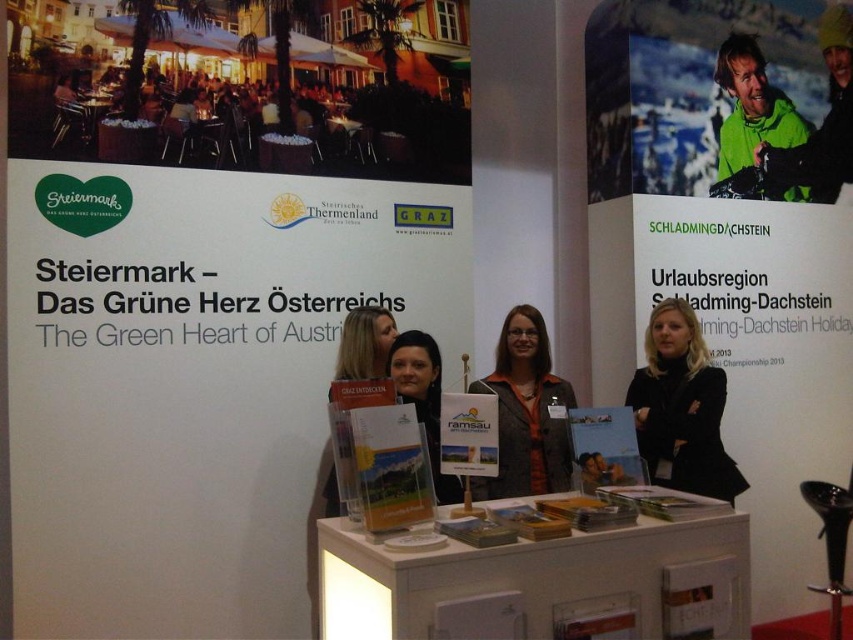
Question: Based on their relative distances, which object is farther from the matte black hair at center?

Choices:
 (A) black glossy poster at right
 (B) white glossy table at center
 (C) matte black jacket at center
 (D) black fabric at center

Answer: (A)

Question: Estimate the real-world distances between objects in this image. Which object is farther from the black glossy poster at right?

Choices:
 (A) green matte jacket at upper right
 (B) white glossy table at center

Answer: (B)

Question: Is black glossy poster at right positioned behind black fabric at center?

Choices:
 (A) yes
 (B) no

Answer: (A)

Question: Is black glossy poster at right further to the viewer compared to matte black hair at center?

Choices:
 (A) yes
 (B) no

Answer: (A)

Question: Can you confirm if black glossy poster at right is positioned to the left of matte black hair at center?

Choices:
 (A) yes
 (B) no

Answer: (B)

Question: Which of these objects is positioned farthest from the black glossy poster at right?

Choices:
 (A) green matte jacket at upper right
 (B) matte brown shirt at center

Answer: (B)